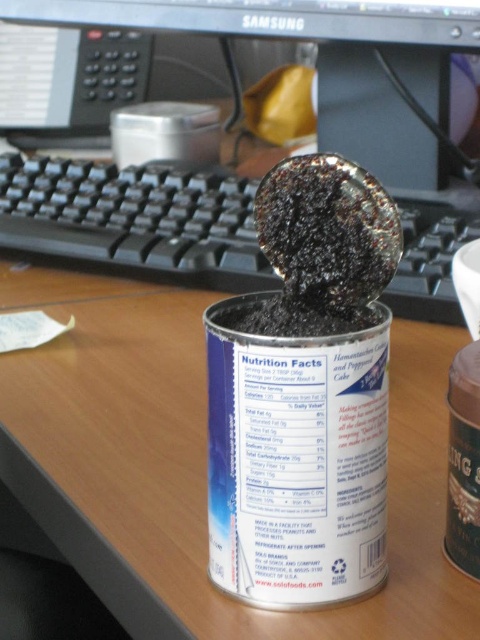
Question: Among these objects, which one is nearest to the camera?

Choices:
 (A) matte black monitor at upper center
 (B) black plastic keyboard at center

Answer: (B)

Question: Is black plastic keyboard at center further to camera compared to matte black monitor at upper center?

Choices:
 (A) yes
 (B) no

Answer: (B)

Question: Which of the following is the closest to the observer?

Choices:
 (A) click(x=380, y=17)
 (B) click(x=45, y=177)
 (C) click(x=180, y=596)

Answer: (C)

Question: Can you confirm if metallic silver can at center is positioned to the right of matte black monitor at upper center?

Choices:
 (A) yes
 (B) no

Answer: (A)

Question: Which object appears farthest from the camera in this image?

Choices:
 (A) black plastic keyboard at center
 (B) matte black monitor at upper center
 (C) metallic silver can at center

Answer: (B)

Question: Is black plastic keyboard at center to the left of matte black monitor at upper center from the viewer's perspective?

Choices:
 (A) no
 (B) yes

Answer: (A)